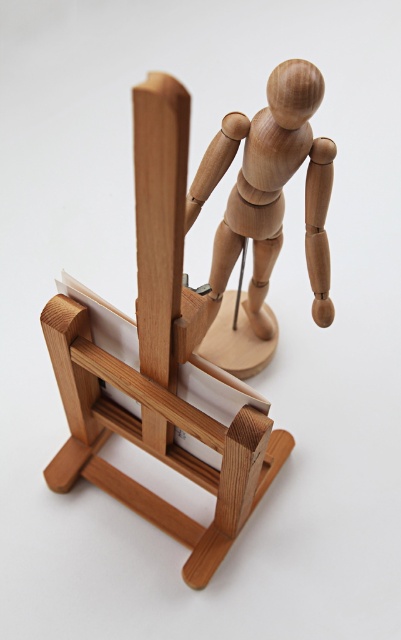
Identify the location of natural wood mannequin at center. (194, 308).

Does natural wood mannequin at center appear on the right side of natural wood mannequin at upper center?

Incorrect, natural wood mannequin at center is not on the right side of natural wood mannequin at upper center.

Identify the location of natural wood mannequin at center. (194, 308).

Locate an element on the screen. This screenshot has width=401, height=640. natural wood mannequin at center is located at coordinates (194, 308).